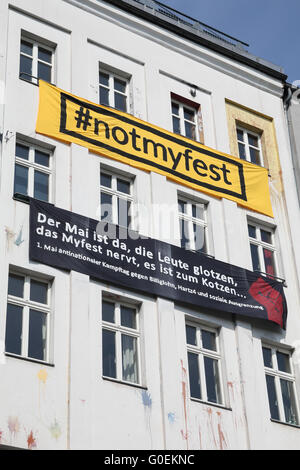
Identify the location of windows. (37, 62), (36, 346), (125, 351), (205, 368), (282, 395).